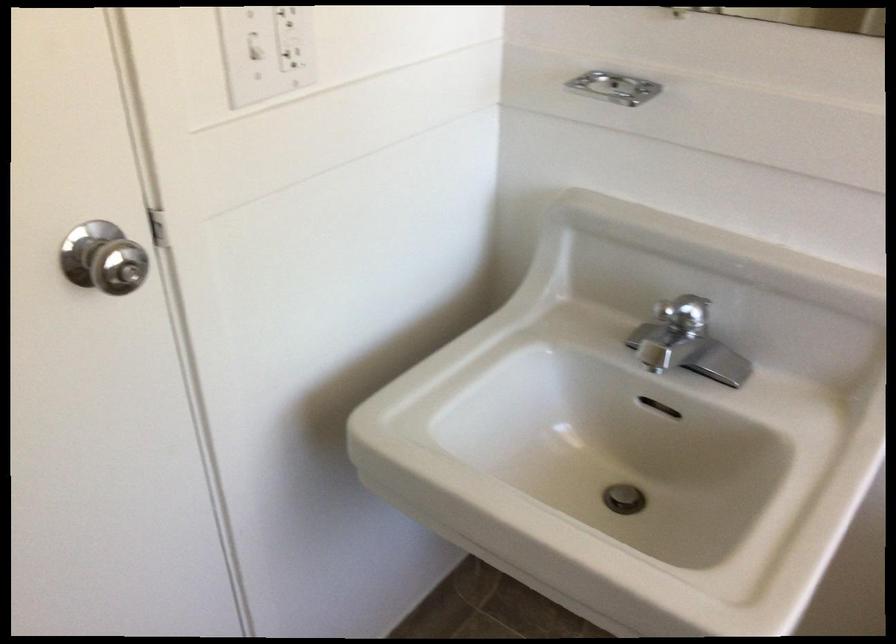
The image size is (896, 644). What do you see at coordinates (624, 498) in the screenshot?
I see `a sink drain` at bounding box center [624, 498].